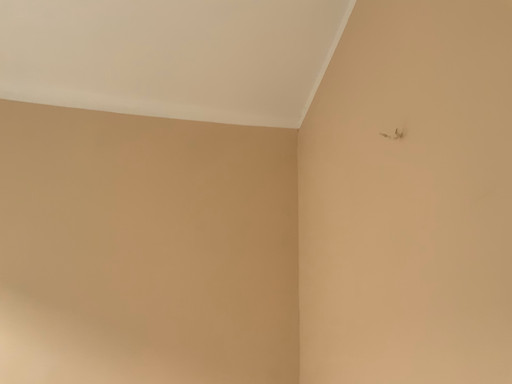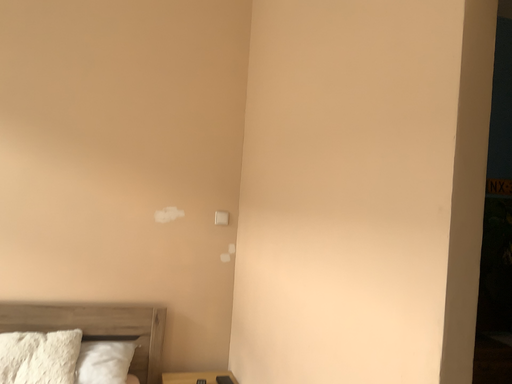
Question: How did the camera likely rotate when shooting the video?

Choices:
 (A) rotated downward
 (B) rotated upward

Answer: (A)